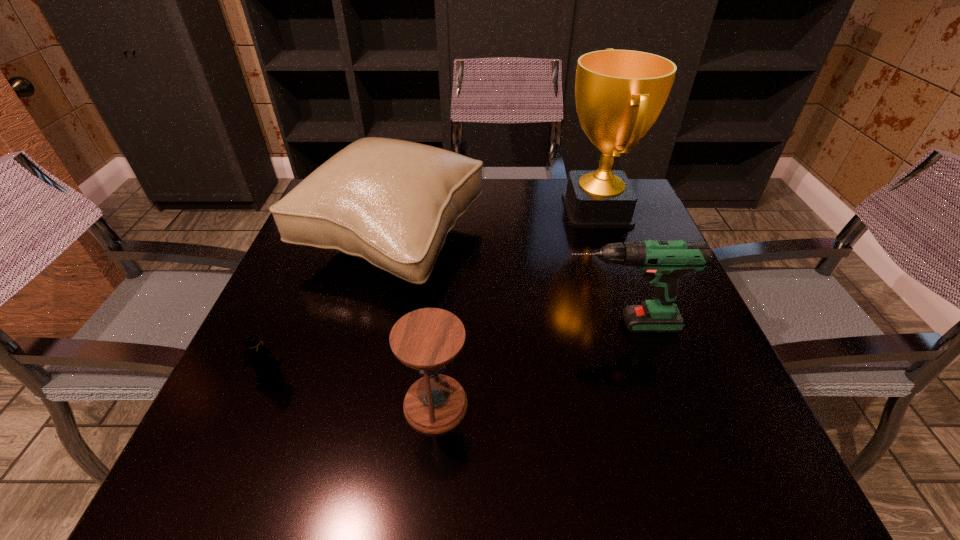
This screenshot has width=960, height=540. In order to click on free space that satisfies the following two spatial constraints: 1. on the front-facing side of the award; 2. on the face of the Lego in this screenshot , I will do `click(656, 376)`.

I want to click on free space in the image that satisfies the following two spatial constraints: 1. on the front-facing side of the award; 2. on the face of the shortest object, so click(x=656, y=376).